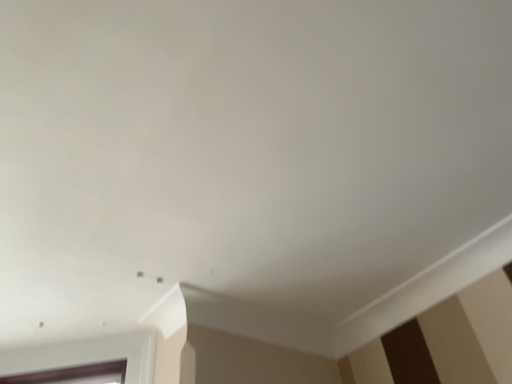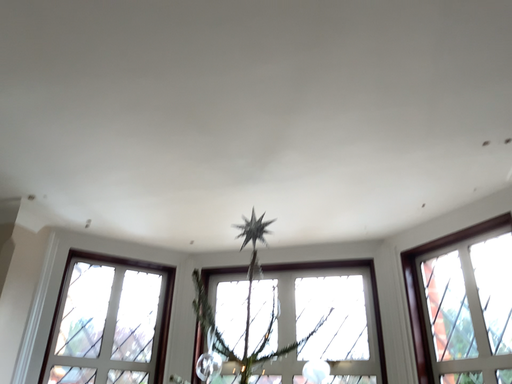
Question: Which way did the camera rotate in the video?

Choices:
 (A) rotated right
 (B) rotated left

Answer: (B)